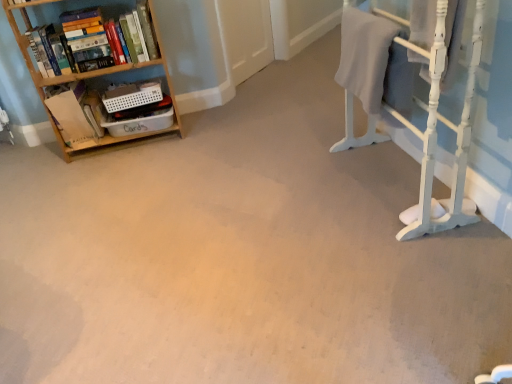
Where is `vacant space situated on the left part of white painted wood bunk bed at right`? The height and width of the screenshot is (384, 512). vacant space situated on the left part of white painted wood bunk bed at right is located at coordinates (289, 208).